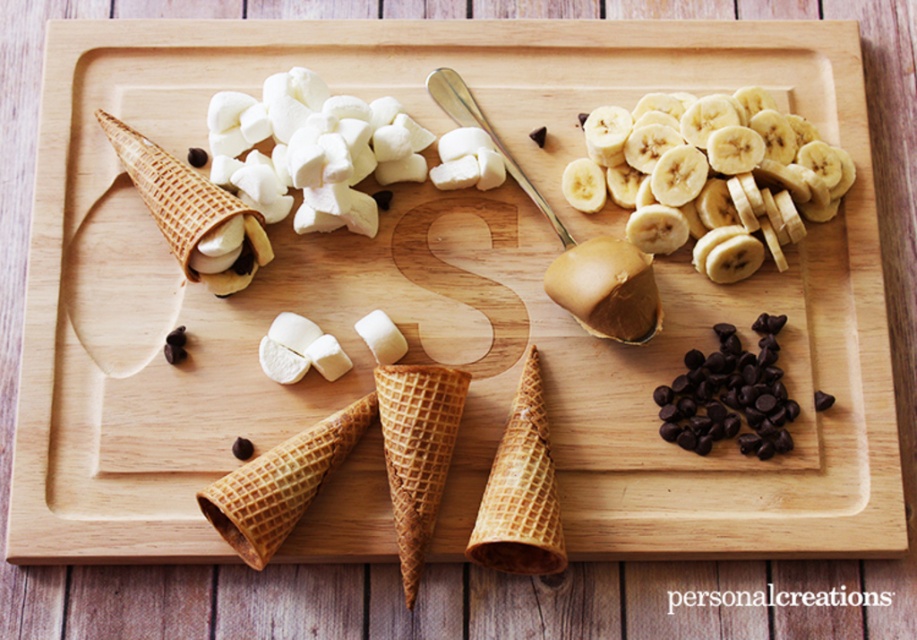
What are the coordinates of the yellow smooth banana at upper right?

The yellow smooth banana at upper right is located at coordinates point (709, 173).

You are a chef preparing a dessert and need to place the yellow smooth banana at upper right closer to the dark chocolate chips at lower right. How much distance do you need to move it to make them touch each other?

The yellow smooth banana at upper right is currently 5.80 inches away from the dark chocolate chips at lower right. To make them touch, you need to move the banana by 5.80 inches towards the chocolate chips.